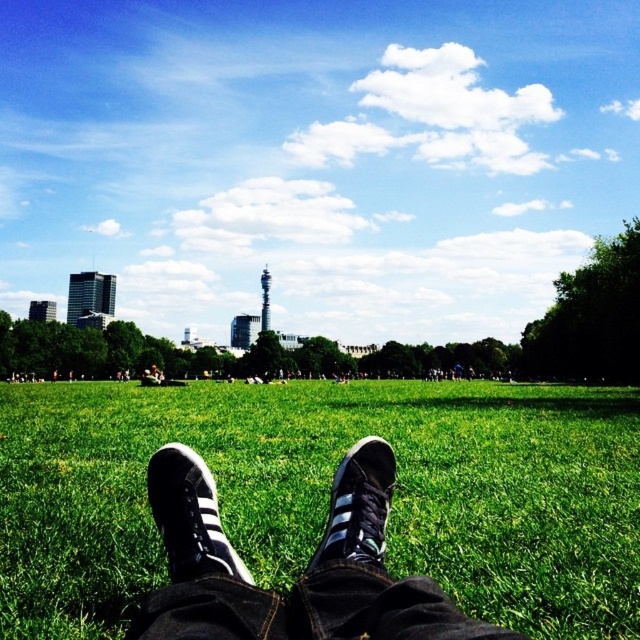
You are standing in the grassy field and see the black suede sneaker at lower center and the black suede shoe at center. Which one is closer to your feet?

The black suede sneaker at lower center is above the black suede shoe at center, meaning it is closer to your feet.

You are a photographer planning to take a photo of the black suede sneakers at center and the black suede sneaker at lower center. Which one should you focus on if you want to capture the larger object in your shot?

The black suede sneakers at center is larger in size than the black suede sneaker at lower center, so you should focus on the black suede sneakers at center to capture the larger object.